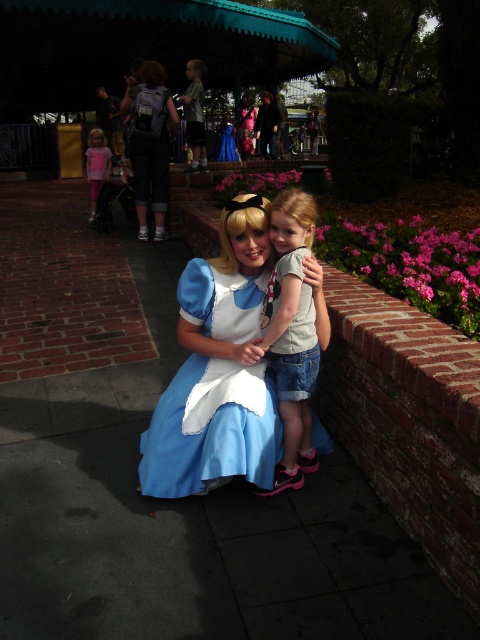
You are a photographer trying to capture a photo of the denim shorts at center and the matte black backpack at upper center. Based on their positions, which object should you focus on first to ensure both are in the frame?

The denim shorts at center is positioned on the right side of matte black backpack at upper center, so you should focus on the matte black backpack at upper center first to ensure both are in the frame.

You are a photographer trying to capture a candid shot of the pink cotton shirt at left and the matte black backpack at upper center. To ensure both are in frame, should you adjust your camera to a wider angle or a narrower angle?

Since the matte black backpack at upper center is to the right of the pink cotton shirt at left, you should adjust your camera to a wider angle to ensure both are in frame.